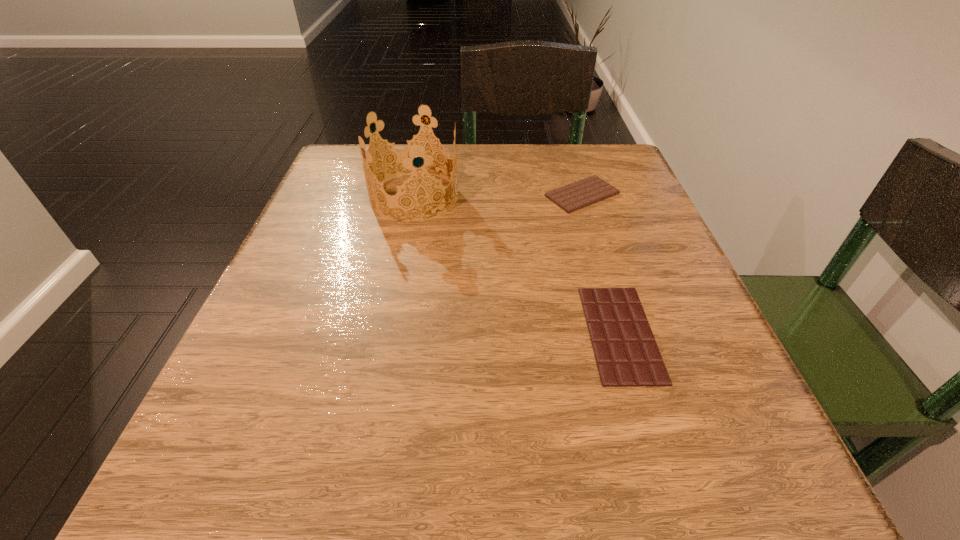
Locate an element on the screen. free point between the second shortest object and the leftmost object is located at coordinates coord(498,195).

Locate which object ranks in proximity to the nearest object. Please provide its 2D coordinates. Your answer should be formatted as a tuple, i.e. [(x, y)], where the tuple contains the x and y coordinates of a point satisfying the conditions above.

[(580, 194)]

Find the location of `the closest object to the nearest object`. the closest object to the nearest object is located at coordinates (580, 194).

You are a GUI agent. You are given a task and a screenshot of the screen. Output one action in this format:
    pyautogui.click(x=<x>, y=<y>)
    Task: Click on the vacant position in the image that satisfies the following two spatial constraints: 1. on the front side of the nearest object; 2. on the left side of the crown
    The width and height of the screenshot is (960, 540).
    Given the screenshot: What is the action you would take?
    tap(387, 333)

Find the location of `blank space that satisfies the following two spatial constraints: 1. on the front side of the nearest object; 2. on the right side of the crown`. blank space that satisfies the following two spatial constraints: 1. on the front side of the nearest object; 2. on the right side of the crown is located at coordinates (387, 333).

Where is `free point that satisfies the following two spatial constraints: 1. on the back side of the farther chocolate bar; 2. on the left side of the leftmost object`? The image size is (960, 540). free point that satisfies the following two spatial constraints: 1. on the back side of the farther chocolate bar; 2. on the left side of the leftmost object is located at coordinates (415, 195).